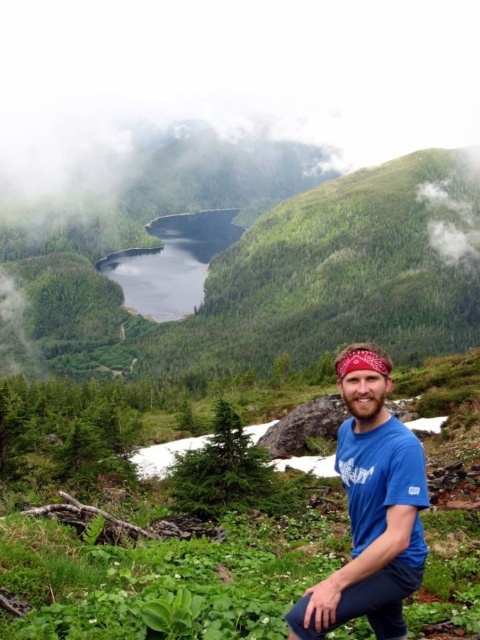
You are a photographer trying to capture the scene. The blue cotton shirt at center is at point 0.795, 0.773. If you want to place the shirt exactly at the center of the frame, which is point 0.5, 0.5, should you move the camera to the left or right? And up or down?

The blue cotton shirt at center is currently at point (371, 508). To move it closer to the center point (240, 320), you should move the camera to the left and up. Moving left reduces the x coordinate from 0.795 towards 0.5, and moving up reduces the y coordinate from 0.773 towards 0.5.

You are a photographer standing in the scenic outdoor setting. You need to position yourself so that the blue cotton shirt at center and the deep blue water at center are both visible in your shot. Which object should you place on the left side of your frame?

The deep blue water at center should be placed on the left side of your frame because the blue cotton shirt at center is to the right of it.

You are a photographer trying to capture the man in the blue cotton shirt at center and the deep blue water at center in the same frame. Based on their heights, which object should you focus on first to ensure both are in the shot?

The blue cotton shirt at center has a lesser height compared to the deep blue water at center, so you should focus on the deep blue water at center first to ensure both are in the shot.